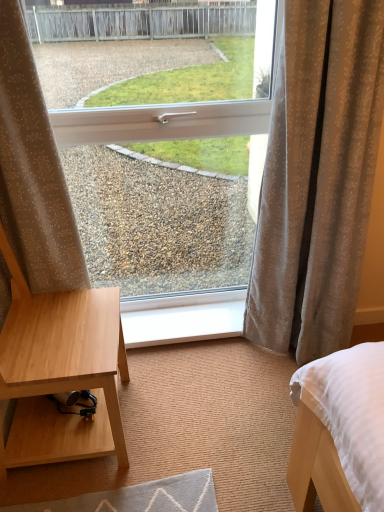
This screenshot has width=384, height=512. I want to click on free space in front of beige textured curtain at right, which appears as the 2th curtain when viewed from the left, so click(x=262, y=416).